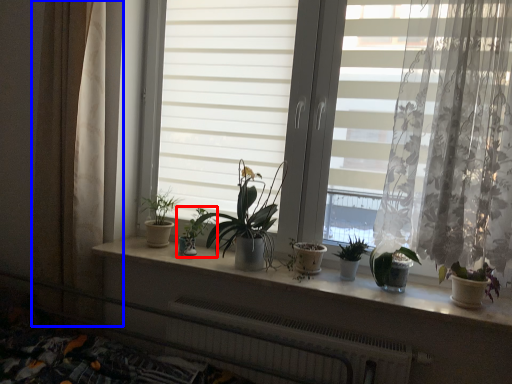
Question: Which point is further to the camera, houseplant (highlighted by a red box) or curtain (highlighted by a blue box)?

Choices:
 (A) houseplant
 (B) curtain

Answer: (A)